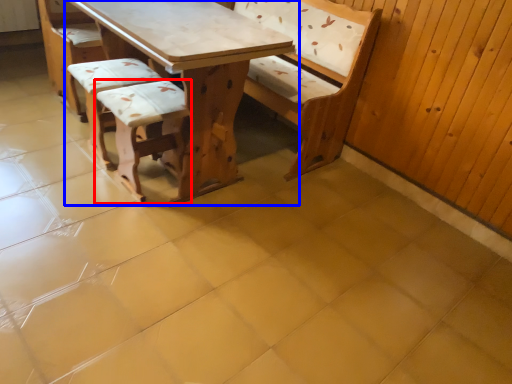
Question: Which object appears closest to the camera in this image, armchair (highlighted by a red box) or table (highlighted by a blue box)?

Choices:
 (A) armchair
 (B) table

Answer: (B)